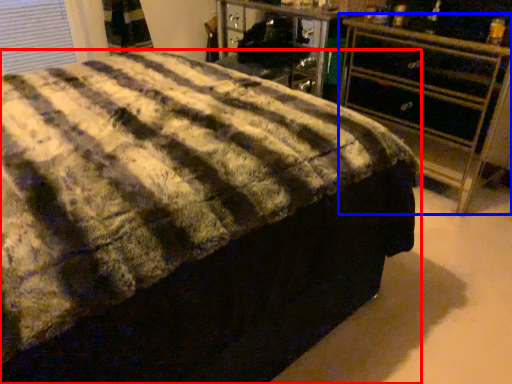
Question: Which object appears farthest to the camera in this image, bed (highlighted by a red box) or chest of drawers (highlighted by a blue box)?

Choices:
 (A) bed
 (B) chest of drawers

Answer: (B)